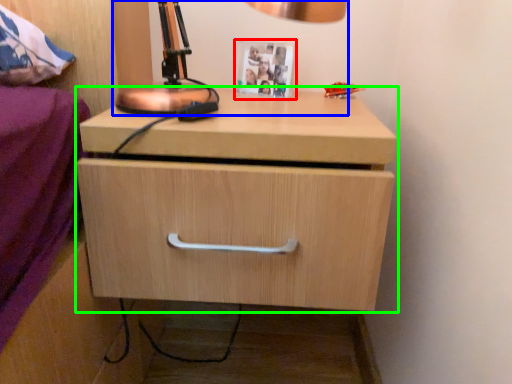
Question: Estimate the real-world distances between objects in this image. Which object is farther from picture frame (highlighted by a red box), table lamp (highlighted by a blue box) or chest of drawers (highlighted by a green box)?

Choices:
 (A) table lamp
 (B) chest of drawers

Answer: (B)